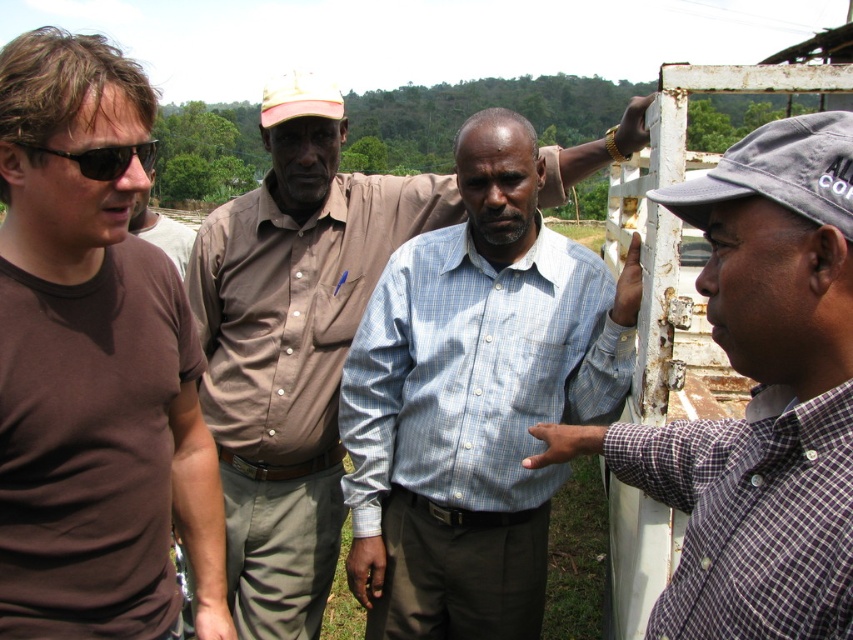
Question: Can you confirm if brown shirt at center is smaller than matte black sunglasses at left?

Choices:
 (A) no
 (B) yes

Answer: (A)

Question: Observing the image, what is the correct spatial positioning of matte brown shirt at left in reference to matte black sunglasses at left?

Choices:
 (A) above
 (B) below

Answer: (A)

Question: Which point is farther to the camera?

Choices:
 (A) brown t-shirt at left
 (B) matte brown shirt at left

Answer: (B)

Question: Does checkered shirt at center come in front of brown t-shirt at left?

Choices:
 (A) yes
 (B) no

Answer: (A)

Question: Among these objects, which one is farthest from the camera?

Choices:
 (A) matte black sunglasses at left
 (B) brown shirt at center
 (C) checkered shirt at center

Answer: (B)

Question: Which of the following is the farthest from the observer?

Choices:
 (A) (776, 600)
 (B) (171, 228)
 (C) (105, 157)

Answer: (B)